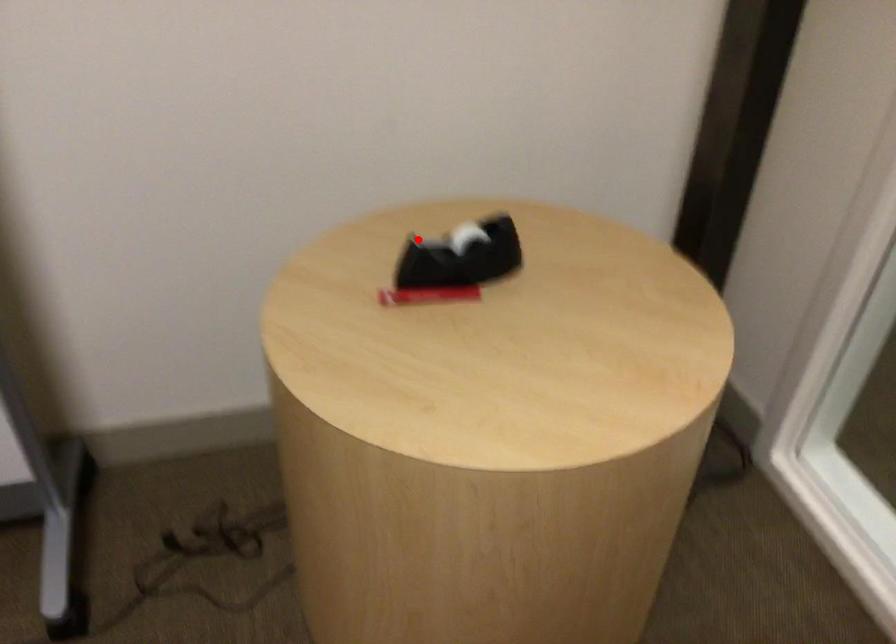
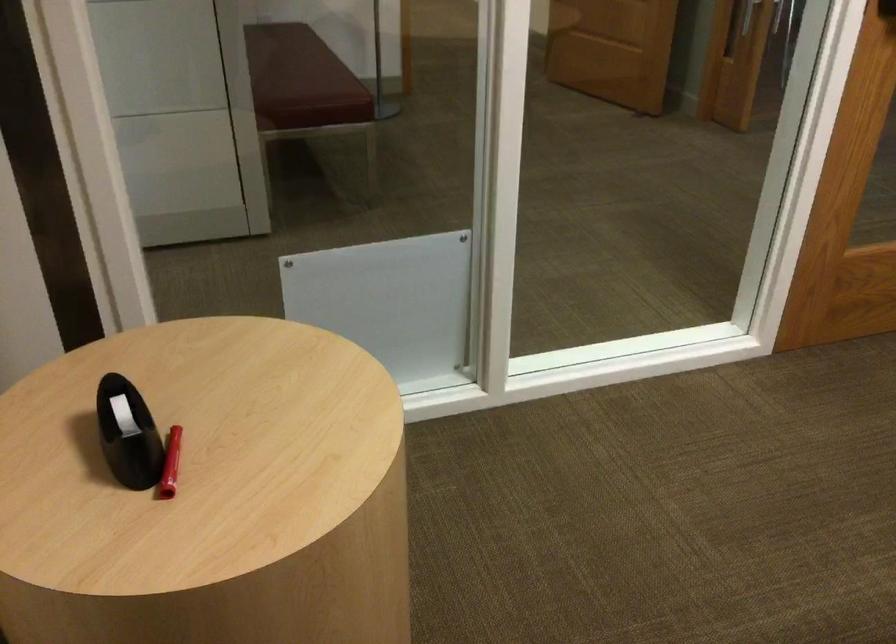
Question: I am providing you with two images of the same scene from different viewpoints. In image1, a red point is highlighted. Considering the same 3D point in image2, which of the following is correct?

Choices:
 (A) It is closer
 (B) It is farther

Answer: (A)